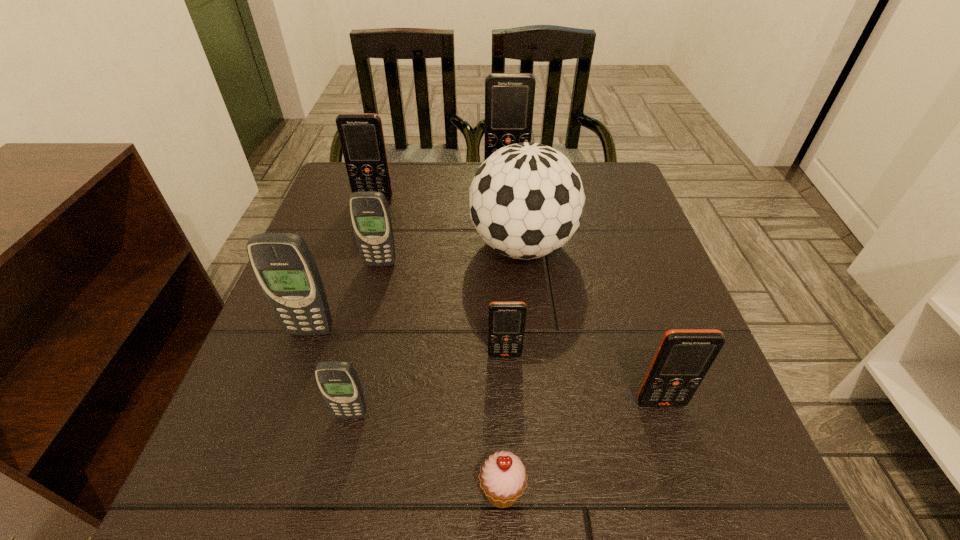
The width and height of the screenshot is (960, 540). I want to click on gray cellular telephone that is the third closest to the second farthest cellular telephone, so click(338, 382).

This screenshot has width=960, height=540. What are the coordinates of `free region that satisfies the following two spatial constraints: 1. on the screen of the fourth nearest cellular telephone; 2. on the right side of the shortest object` in the screenshot? It's located at [254, 490].